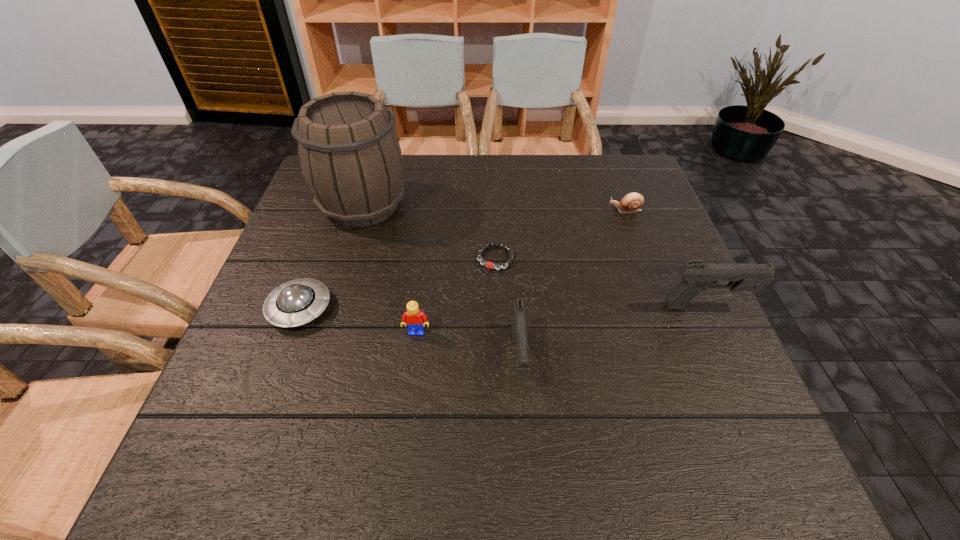
Please point a free position for a pistol on the left. Please provide its 2D coordinates. Your answer should be formatted as a tuple, i.e. [(x, y)], where the tuple contains the x and y coordinates of a point satisfying the conditions above.

[(284, 424)]